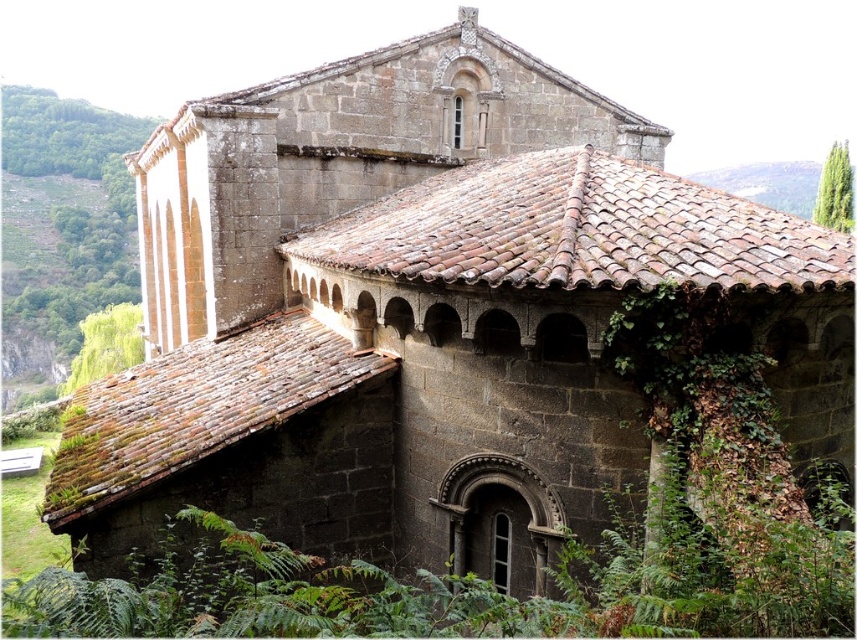
You are an architect examining the ancient stone building. You notice a point at coordinates [63,224]. What object is located at this specific coordinate?

At point [63,224] lies green leafy vegetation at upper left.

You are a drone operator tasked with capturing aerial footage of the ancient stone building. Your drone has a maximum flight range of 120 meters. You need to fly from the green leafy vegetation at upper left to the green leafy tree at upper right to get a wide shot of the building. Will your drone be able to make this flight without exceeding its range?

The distance between the green leafy vegetation at upper left and the green leafy tree at upper right is 124.52 meters. Since the drone has a maximum flight range of 120 meters, it will exceed the range by 4.52 meters. Therefore, the drone cannot make this flight without exceeding its range.